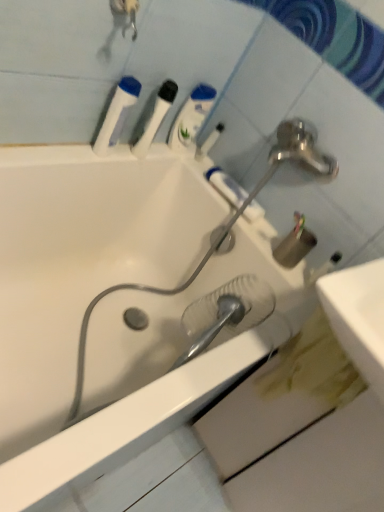
Locate an element on the screen. vacant area to the right of white plastic bottle at upper center, acting as the third mouthwash starting from the left is located at coordinates pos(206,166).